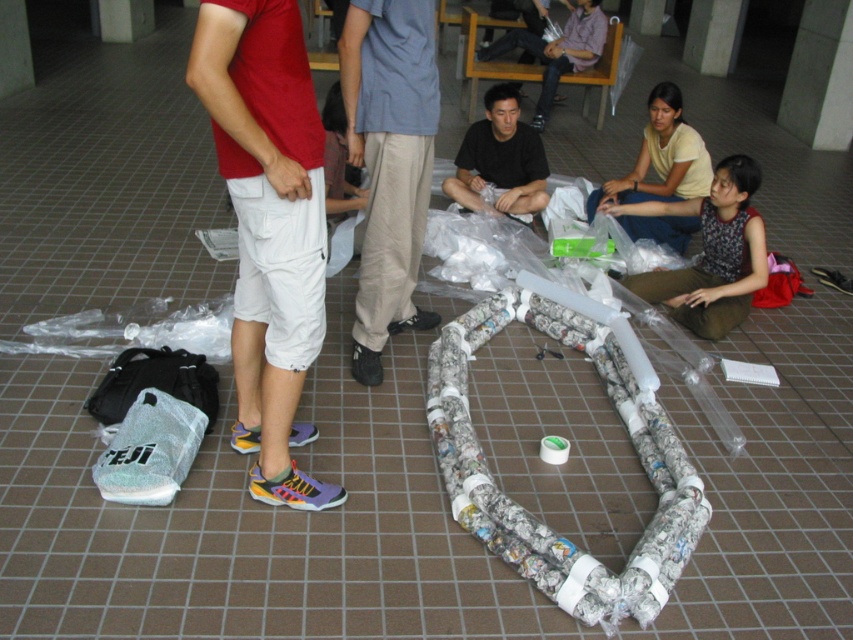
Can you confirm if white cotton shorts at center is smaller than patterned fabric shirt at lower right?

Actually, white cotton shorts at center might be larger than patterned fabric shirt at lower right.

Does white cotton shorts at center appear over patterned fabric shirt at lower right?

Incorrect, white cotton shorts at center is not positioned above patterned fabric shirt at lower right.

Does point (283, 104) come farther from viewer compared to point (747, 236)?

That is False.

The width and height of the screenshot is (853, 640). In order to click on white cotton shorts at center in this screenshot , I will do `click(268, 225)`.

Based on the photo, who is shorter, light yellow cotton shirt at upper right or black matte shirt at center?

Standing shorter between the two is black matte shirt at center.

Can you confirm if light yellow cotton shirt at upper right is wider than black matte shirt at center?

Indeed, light yellow cotton shirt at upper right has a greater width compared to black matte shirt at center.

Describe the element at coordinates (660, 157) in the screenshot. I see `light yellow cotton shirt at upper right` at that location.

Locate an element on the screen. light yellow cotton shirt at upper right is located at coordinates (660, 157).

The height and width of the screenshot is (640, 853). Find the location of `beige cotton pants at center`. beige cotton pants at center is located at coordinates (389, 161).

You are a GUI agent. You are given a task and a screenshot of the screen. Output one action in this format:
    pyautogui.click(x=<x>, y=<y>)
    Task: Click on the beige cotton pants at center
    
    Given the screenshot: What is the action you would take?
    pyautogui.click(x=389, y=161)